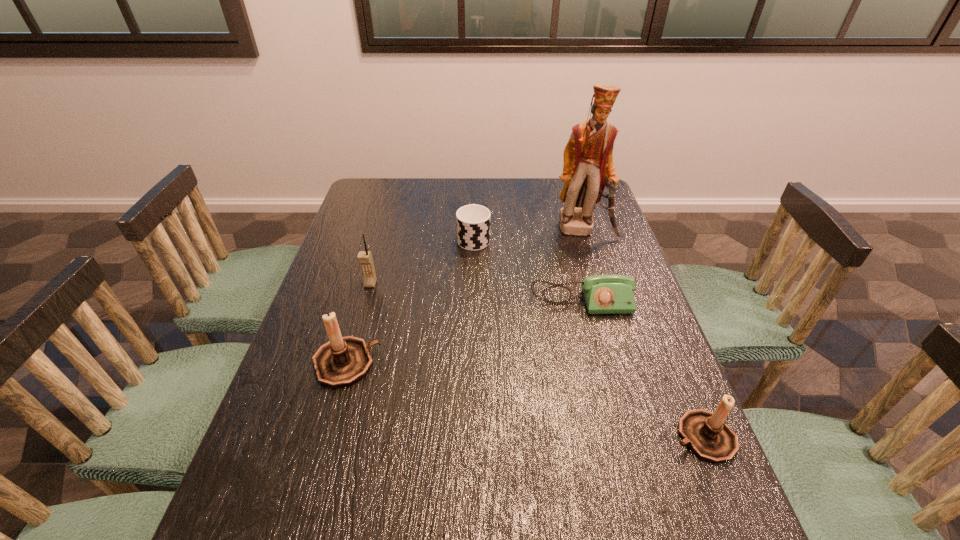
Where is `blank space located on the left of the nearer candle holder`? blank space located on the left of the nearer candle holder is located at coordinates (510, 437).

Locate an element on the screen. The height and width of the screenshot is (540, 960). free location located on the side of the cup with the handle is located at coordinates (474, 203).

Identify the location of free space located on the side of the cup with the handle. This screenshot has width=960, height=540. (474, 193).

The height and width of the screenshot is (540, 960). In order to click on free region located on the side of the cup with the handle in this screenshot , I will do `click(474, 183)`.

Where is `blank space located on the front-facing side of the tallest object`? blank space located on the front-facing side of the tallest object is located at coordinates (592, 256).

This screenshot has height=540, width=960. I want to click on free location located on the dial of the telephone, so click(591, 339).

Identify the location of free spot located on the front of the cellular telephone, where the keypad is located. (355, 337).

Image resolution: width=960 pixels, height=540 pixels. I want to click on object present at the near edge, so click(x=710, y=438).

This screenshot has height=540, width=960. In order to click on candle holder that is positioned at the left edge in this screenshot , I will do `click(342, 361)`.

The height and width of the screenshot is (540, 960). Find the location of `cellular telephone present at the left edge`. cellular telephone present at the left edge is located at coordinates (365, 259).